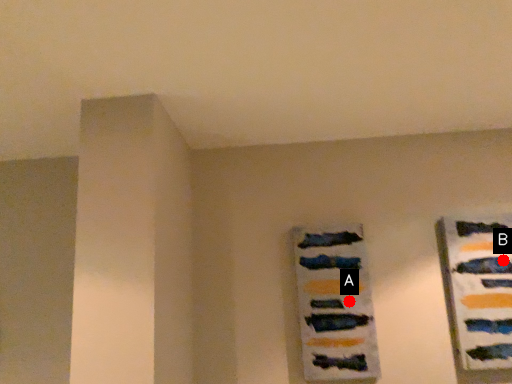
Question: Two points are circled on the image, labeled by A and B beside each circle. Which point appears farthest from the camera in this image?

Choices:
 (A) A is further
 (B) B is further

Answer: (A)